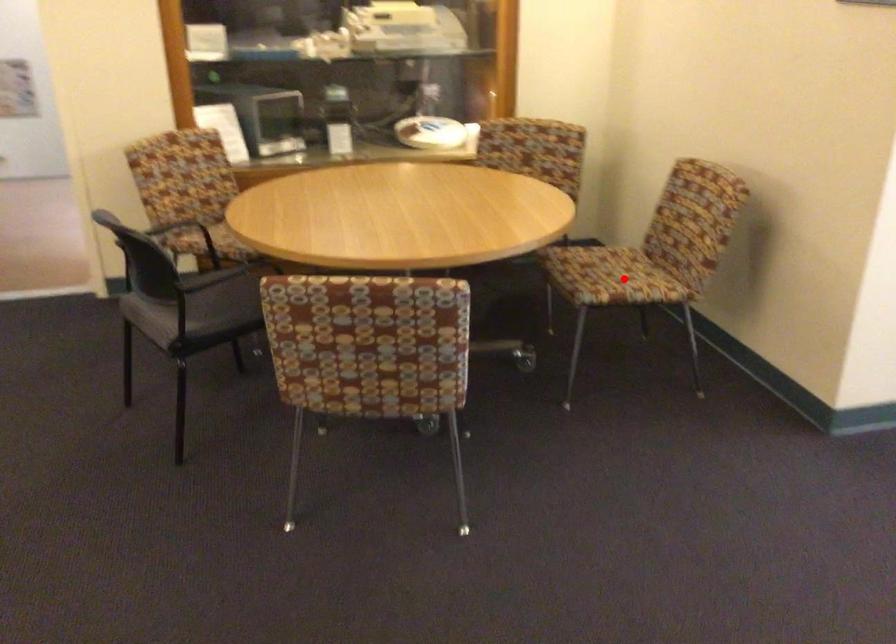
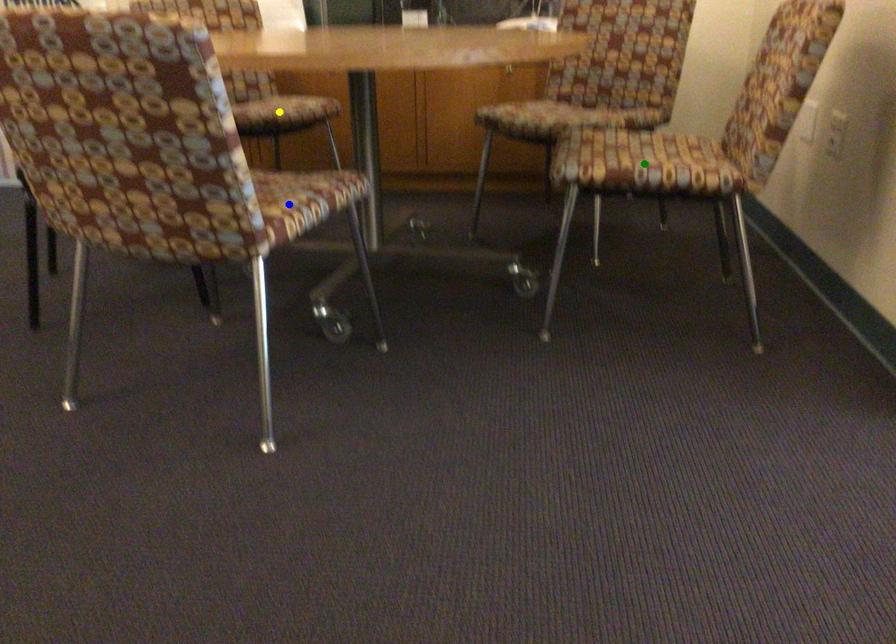
Question: I am providing you with two images of the same scene from different viewpoints. A red point is marked on the first image. You are given multiple points on the second image. Which point in image 2 is actually the same real-world point as the red point in image 1?

Choices:
 (A) green point
 (B) blue point
 (C) yellow point

Answer: (A)